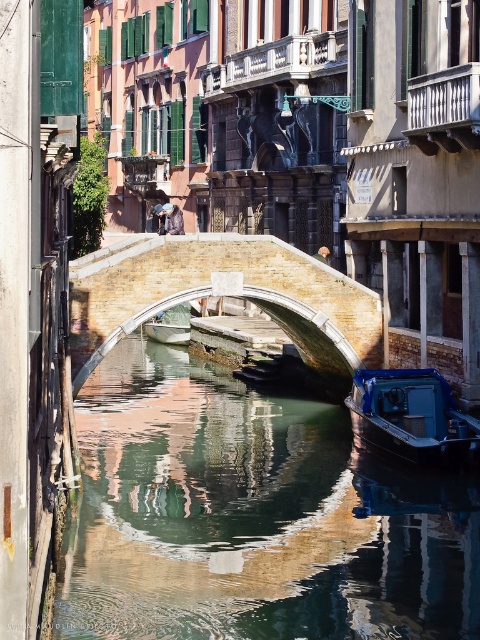
Question: Does blue plastic boat at lower right have a larger size compared to metallic blue boat at center?

Choices:
 (A) yes
 (B) no

Answer: (B)

Question: Does shiny reflective water at center appear on the left side of blue plastic boat at lower right?

Choices:
 (A) no
 (B) yes

Answer: (B)

Question: Which point is farther to the camera?

Choices:
 (A) brick stone bridge at center
 (B) metallic blue boat at center
 (C) shiny reflective water at center

Answer: (B)

Question: Is blue plastic boat at lower right to the left of metallic blue boat at center from the viewer's perspective?

Choices:
 (A) no
 (B) yes

Answer: (A)

Question: Which object is farther from the camera taking this photo?

Choices:
 (A) blue plastic boat at lower right
 (B) metallic blue boat at center
 (C) brick stone bridge at center

Answer: (B)

Question: Among these points, which one is farthest from the camera?

Choices:
 (A) (x=216, y=262)
 (B) (x=356, y=390)

Answer: (B)